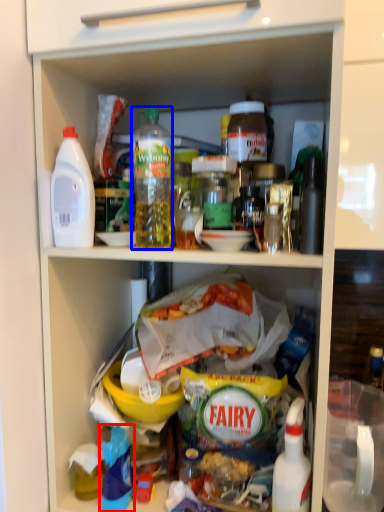
Question: Which point is closer to the camera, cleaning product (highlighted by a red box) or bottle (highlighted by a blue box)?

Choices:
 (A) cleaning product
 (B) bottle

Answer: (B)